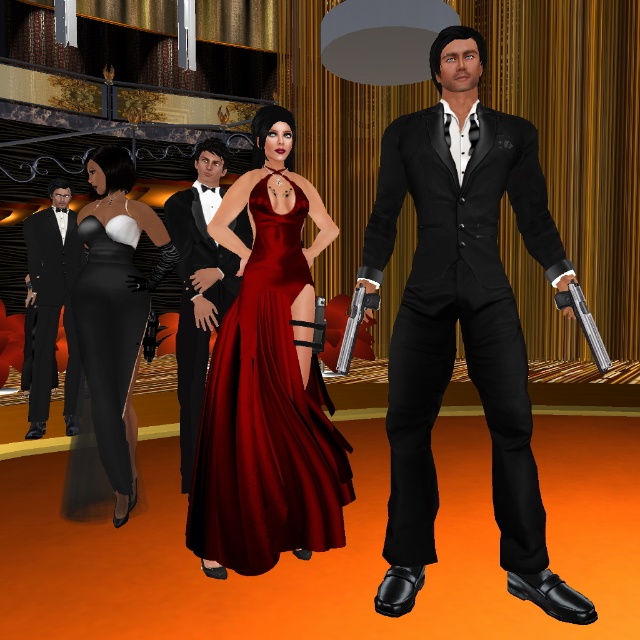
Does matte black suit at center have a larger size compared to shiny satin gown at center?

Incorrect, matte black suit at center is not larger than shiny satin gown at center.

The height and width of the screenshot is (640, 640). Describe the element at coordinates (461, 320) in the screenshot. I see `matte black suit at center` at that location.

Locate an element on the screen. This screenshot has height=640, width=640. matte black suit at center is located at coordinates (461, 320).

Is satin dress at center below shiny black tuxedo at center?

Correct, satin dress at center is located below shiny black tuxedo at center.

Does satin dress at center have a lesser width compared to shiny black tuxedo at center?

No, satin dress at center is not thinner than shiny black tuxedo at center.

Between point (209, 508) and point (195, 372), which one is positioned in front?

Point (209, 508) is more forward.

The height and width of the screenshot is (640, 640). In order to click on satin dress at center in this screenshot , I will do `click(268, 380)`.

Between point (444, 104) and point (54, 256), which one is positioned in front?

Point (444, 104) is more forward.

Is point (529, 234) closer to camera compared to point (48, 362)?

That is True.

At what (x,y) coordinates should I click in order to perform the action: click on matte black suit at center. Please return your answer as a coordinate pair (x, y). The image size is (640, 640). Looking at the image, I should click on (461, 320).

You are a GUI agent. You are given a task and a screenshot of the screen. Output one action in this format:
    pyautogui.click(x=<x>, y=<y>)
    Task: Click on the matte black suit at center
    Image resolution: width=640 pixels, height=640 pixels.
    Given the screenshot: What is the action you would take?
    pyautogui.click(x=461, y=320)